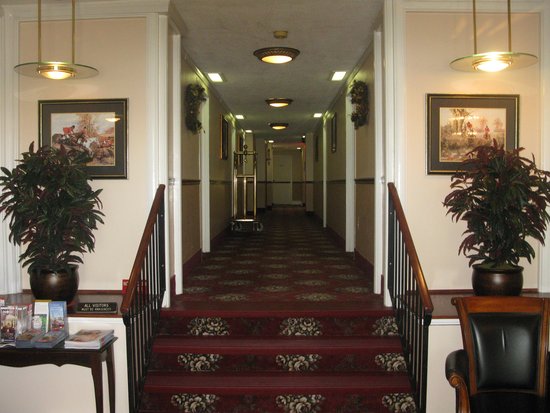
Locate an element on the screen. This screenshot has height=413, width=550. vase is located at coordinates (64, 197), (499, 204).